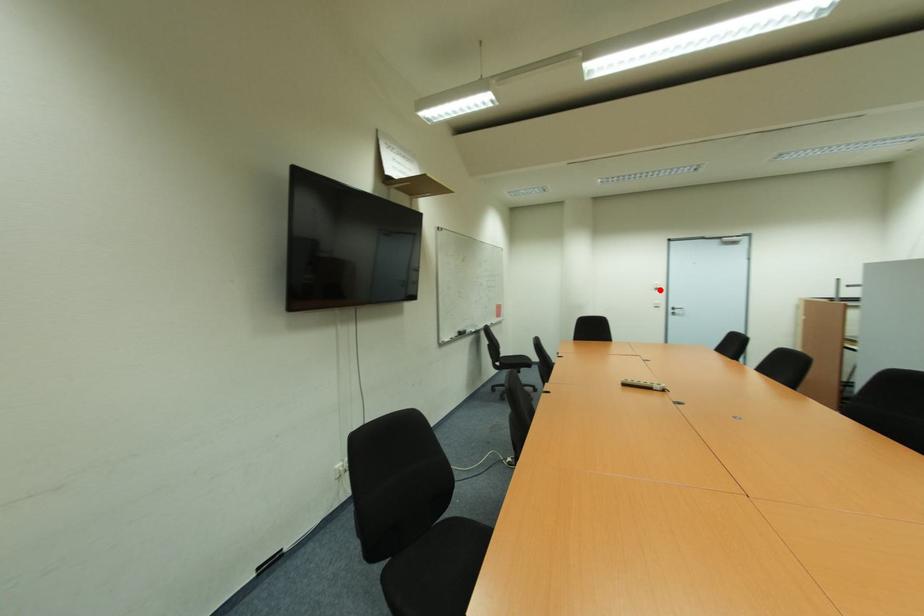
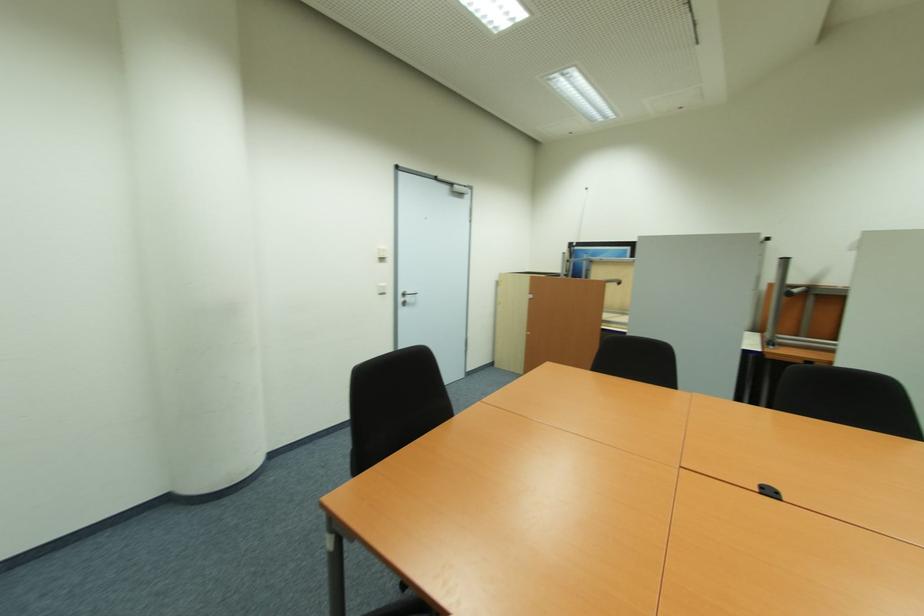
Find the pixel in the second image that matches the highlighted location in the first image.

(385, 260)